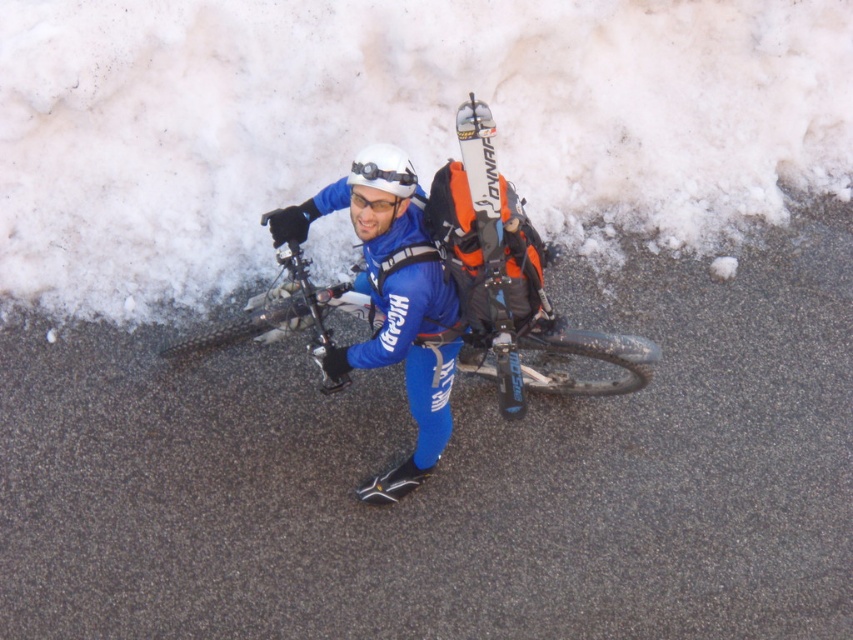
Question: Which object is the farthest from the white matte ski at center?

Choices:
 (A) white matte helmet at center
 (B) blue matte/synthetic suit at center
 (C) white matte goggles at center
 (D) matte black mountain bike at center

Answer: (B)

Question: Is matte black mountain bike at center bigger than white matte ski at center?

Choices:
 (A) yes
 (B) no

Answer: (A)

Question: Which of these objects is positioned closest to the clear plastic goggles at center?

Choices:
 (A) blue matte/synthetic suit at center
 (B) white matte goggles at center

Answer: (B)

Question: Is white matte helmet at center positioned in front of clear plastic goggles at center?

Choices:
 (A) yes
 (B) no

Answer: (A)

Question: Which object is positioned closest to the matte black mountain bike at center?

Choices:
 (A) white matte helmet at center
 (B) white matte ski at center

Answer: (B)

Question: Can you confirm if blue matte/synthetic suit at center is positioned above clear plastic goggles at center?

Choices:
 (A) yes
 (B) no

Answer: (B)